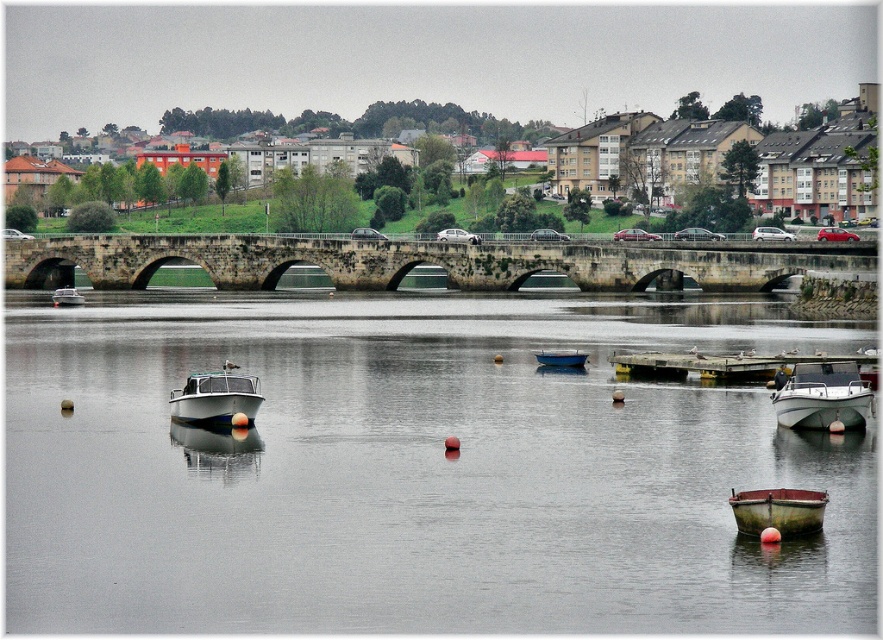
Can you confirm if rusty wooden boat at lower right is wider than blue matte boat at center?

Yes, rusty wooden boat at lower right is wider than blue matte boat at center.

What do you see at coordinates (778, 509) in the screenshot? The image size is (883, 640). I see `rusty wooden boat at lower right` at bounding box center [778, 509].

Locate an element on the screen. rusty wooden boat at lower right is located at coordinates (778, 509).

Between smooth gray water at center and white glossy boat at lower right, which one is positioned lower?

white glossy boat at lower right is lower down.

Describe the element at coordinates (416, 468) in the screenshot. I see `smooth gray water at center` at that location.

This screenshot has height=640, width=883. In order to click on smooth gray water at center in this screenshot , I will do `click(416, 468)`.

You are a GUI agent. You are given a task and a screenshot of the screen. Output one action in this format:
    pyautogui.click(x=<x>, y=<y>)
    Task: Click on the smooth gray water at center
    
    Given the screenshot: What is the action you would take?
    pyautogui.click(x=416, y=468)

Which is in front, point (59, 392) or point (487, 284)?

Point (59, 392) is more forward.

Locate an element on the screen. This screenshot has width=883, height=640. smooth gray water at center is located at coordinates (416, 468).